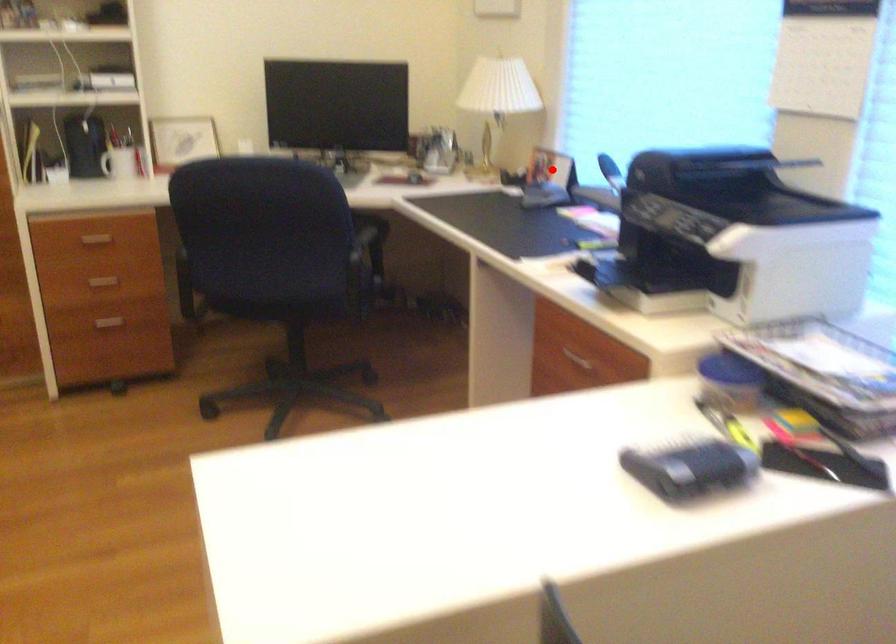
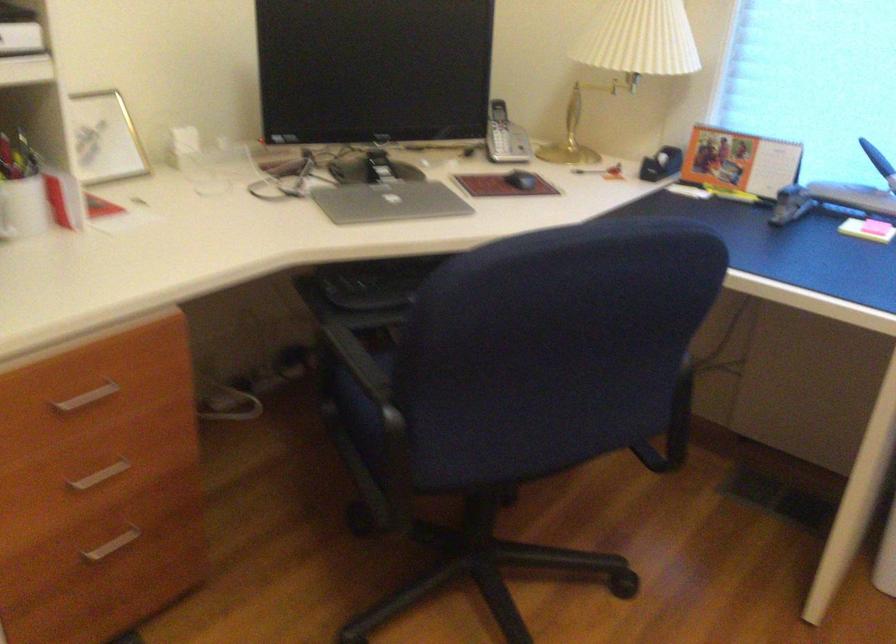
Question: I am providing you with two images of the same scene from different viewpoints. Given a red point in image1, look at the same physical point in image2. Is it:

Choices:
 (A) Closer to the viewpoint
 (B) Farther from the viewpoint

Answer: (A)